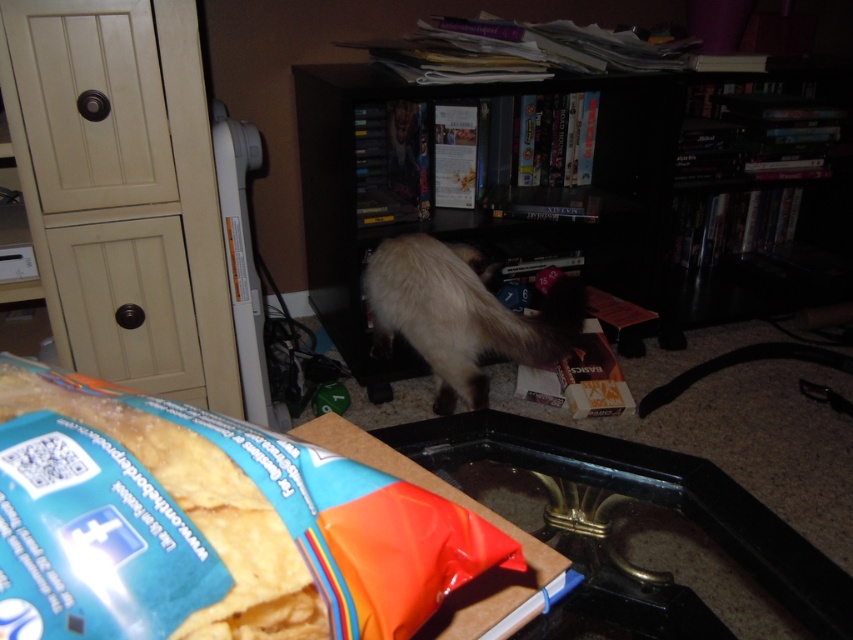
Which of these two, black matte bookcase at center or fuzzy brown cat at center, stands taller?

black matte bookcase at center is taller.

This screenshot has width=853, height=640. Describe the element at coordinates (570, 216) in the screenshot. I see `black matte bookcase at center` at that location.

Find the location of `black matte bookcase at center`. black matte bookcase at center is located at coordinates (570, 216).

Is translucent plastic bag of chips at lower center to the right of black matte bookcase at center from the viewer's perspective?

In fact, translucent plastic bag of chips at lower center is to the left of black matte bookcase at center.

Does translucent plastic bag of chips at lower center appear on the left side of black matte bookcase at center?

Yes, translucent plastic bag of chips at lower center is to the left of black matte bookcase at center.

Who is more distant from viewer, (32,458) or (607,198)?

The point (607,198) is more distant.

This screenshot has width=853, height=640. Find the location of `translucent plastic bag of chips at lower center`. translucent plastic bag of chips at lower center is located at coordinates (207, 525).

Which of these two, translucent plastic bag of chips at lower center or fuzzy brown cat at center, stands taller?

fuzzy brown cat at center

Who is shorter, translucent plastic bag of chips at lower center or fuzzy brown cat at center?

Standing shorter between the two is translucent plastic bag of chips at lower center.

What do you see at coordinates (207, 525) in the screenshot? I see `translucent plastic bag of chips at lower center` at bounding box center [207, 525].

At what (x,y) coordinates should I click in order to perform the action: click on translucent plastic bag of chips at lower center. Please return your answer as a coordinate pair (x, y). Image resolution: width=853 pixels, height=640 pixels. Looking at the image, I should click on (207, 525).